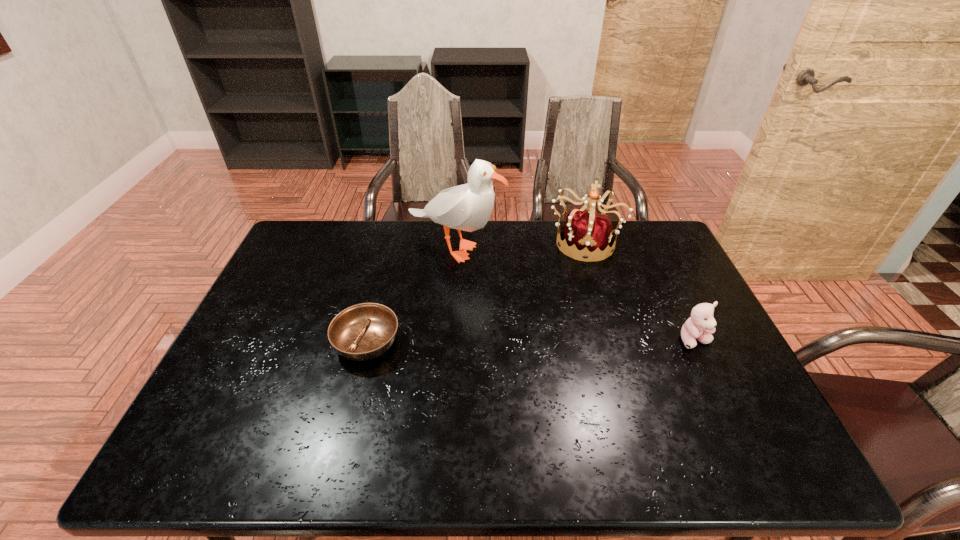
Where is `the shortest object`? the shortest object is located at coordinates (362, 332).

The height and width of the screenshot is (540, 960). Find the location of `the third tallest object`. the third tallest object is located at coordinates [701, 324].

You are a GUI agent. You are given a task and a screenshot of the screen. Output one action in this format:
    pyautogui.click(x=<x>, y=<y>)
    Task: Click on the teddy bear
    This screenshot has width=960, height=540.
    Given the screenshot: What is the action you would take?
    pyautogui.click(x=701, y=324)

I want to click on the tallest object, so click(467, 207).

Identify the location of the third object from left to right. This screenshot has width=960, height=540. (585, 229).

Where is `tiara`? This screenshot has height=540, width=960. tiara is located at coordinates (585, 229).

This screenshot has width=960, height=540. What are the coordinates of `vacant space situated on the left of the shortest object` in the screenshot? It's located at (233, 342).

At what (x,y) coordinates should I click in order to perform the action: click on vacant space located at the face of the second shortest object. Please return your answer as a coordinate pair (x, y). The image size is (960, 540). Looking at the image, I should click on [730, 412].

Locate an element on the screen. Image resolution: width=960 pixels, height=540 pixels. vacant area situated at the beak of the tallest object is located at coordinates (483, 280).

Where is `vacant space located at the beak of the tallest object`? The image size is (960, 540). vacant space located at the beak of the tallest object is located at coordinates (518, 329).